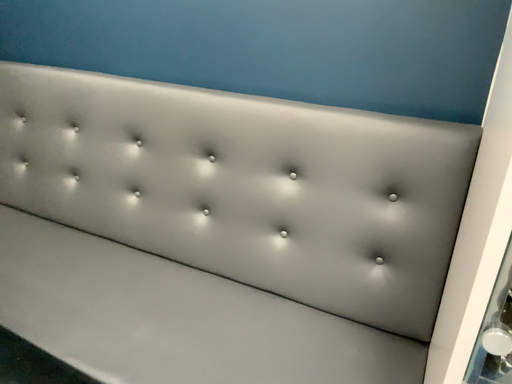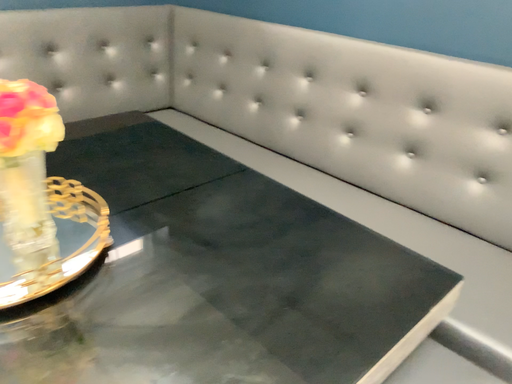
Question: How did the camera likely rotate when shooting the video?

Choices:
 (A) rotated right
 (B) rotated left

Answer: (B)